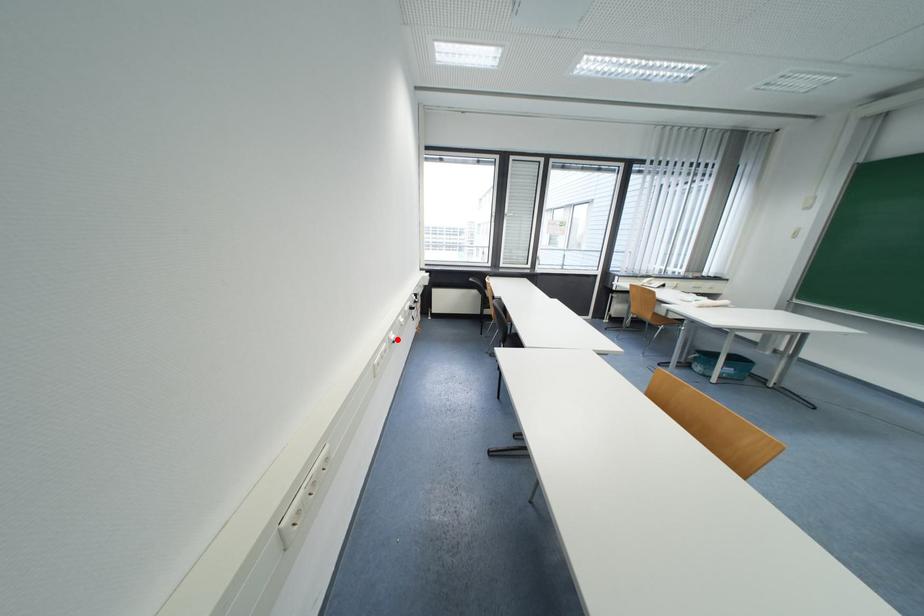
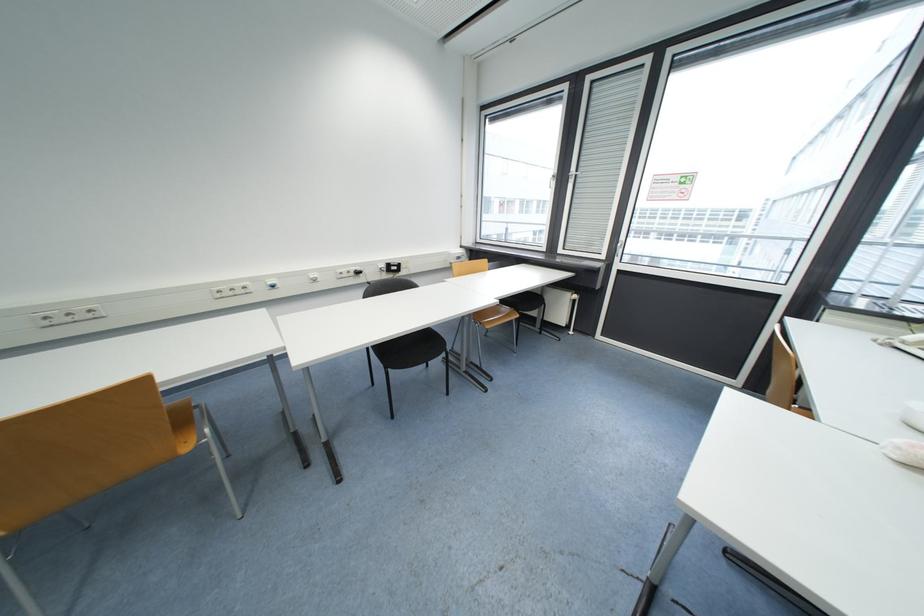
Question: I am providing you with two images of the same scene from different viewpoints. Given a red point in image1, look at the same physical point in image2. Is it:

Choices:
 (A) Closer to the viewpoint
 (B) Farther from the viewpoint

Answer: (B)